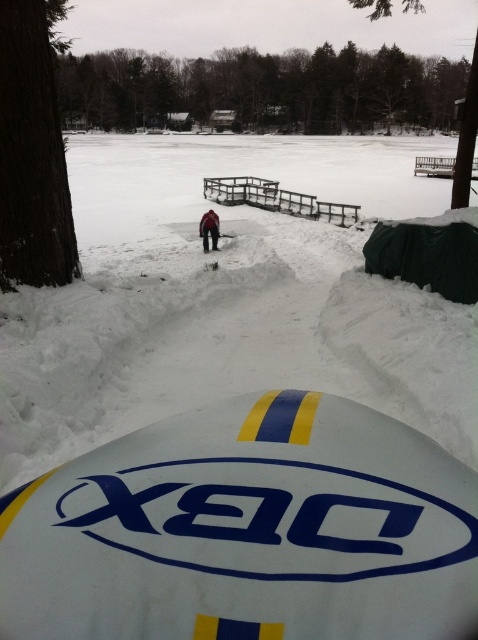
Question: Does white glossy surfboard at center have a greater width compared to dark brown fur coat at center?

Choices:
 (A) no
 (B) yes

Answer: (B)

Question: Can you confirm if green leafy tree at upper center is bigger than dark brown wood at left?

Choices:
 (A) no
 (B) yes

Answer: (B)

Question: Can you confirm if white glossy surfboard at center is bigger than green leafy tree at upper center?

Choices:
 (A) yes
 (B) no

Answer: (B)

Question: Which object appears farthest from the camera in this image?

Choices:
 (A) white glossy surfboard at center
 (B) green leafy tree at upper center
 (C) dark brown wood at left

Answer: (B)

Question: Which point is closer to the camera?

Choices:
 (A) green leafy tree at upper center
 (B) dark brown fur coat at center

Answer: (A)

Question: Estimate the real-world distances between objects in this image. Which object is farther from the white glossy surfboard at center?

Choices:
 (A) dark brown wood at left
 (B) green leafy tree at upper center

Answer: (B)